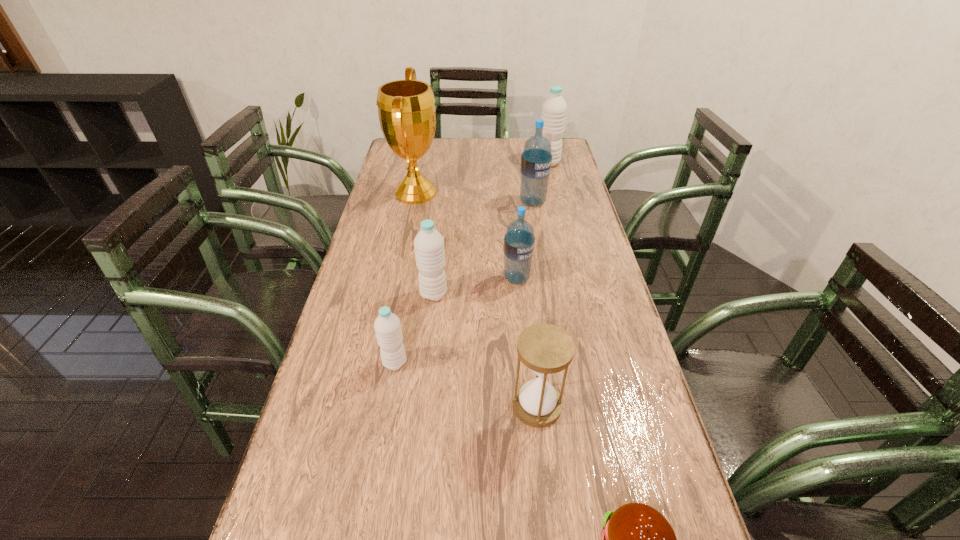
Locate an element on the screen. free space between the smaller blue water bottle and the gold award is located at coordinates (467, 235).

Locate an element on the screen. vacant space that is in between the second nearest object and the biggest white water bottle is located at coordinates (542, 284).

You are a GUI agent. You are given a task and a screenshot of the screen. Output one action in this format:
    pyautogui.click(x=<x>, y=<y>)
    Task: Click on the unoccupied area between the gold award and the leftmost white water bottle
    Image resolution: width=960 pixels, height=540 pixels.
    Given the screenshot: What is the action you would take?
    pyautogui.click(x=405, y=278)

Locate an element on the screen. object that is the second closest to the gold award is located at coordinates (429, 249).

Select which object appears as the fourth closest to the second water bottle from left to right. Please provide its 2D coordinates. Your answer should be formatted as a tuple, i.e. [(x, y)], where the tuple contains the x and y coordinates of a point satisfying the conditions above.

[(546, 349)]

Locate an element on the screen. The width and height of the screenshot is (960, 540). water bottle that is the closest to the rightmost white water bottle is located at coordinates (536, 159).

Identify which water bottle is the fourth nearest to the gold award. Please provide its 2D coordinates. Your answer should be formatted as a tuple, i.e. [(x, y)], where the tuple contains the x and y coordinates of a point satisfying the conditions above.

[(554, 109)]

This screenshot has width=960, height=540. What are the coordinates of `white water bottle that is the closest to the farthest water bottle` in the screenshot? It's located at (429, 249).

You are a GUI agent. You are given a task and a screenshot of the screen. Output one action in this format:
    pyautogui.click(x=<x>, y=<y>)
    Task: Click on the white water bottle that is the second closest to the second white water bottle from left to right
    
    Given the screenshot: What is the action you would take?
    pyautogui.click(x=554, y=109)

Where is `blue water bottle that is the closest to the second farthest white water bottle`? The width and height of the screenshot is (960, 540). blue water bottle that is the closest to the second farthest white water bottle is located at coordinates (519, 240).